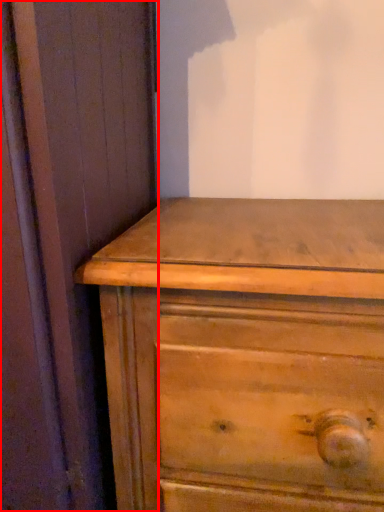
Question: From the image, what is the correct spatial relationship of screen door (annotated by the red box) in relation to chest of drawers?

Choices:
 (A) right
 (B) left

Answer: (B)